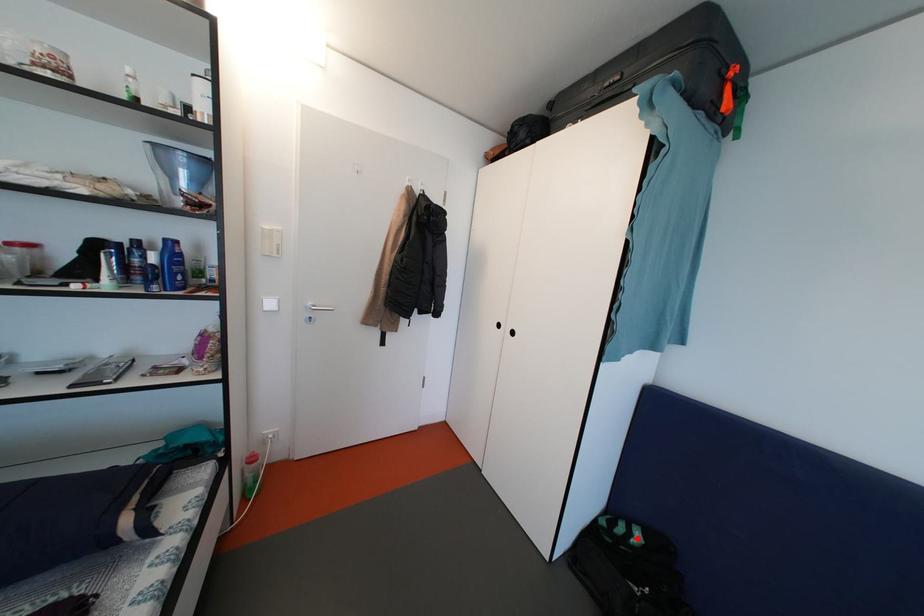
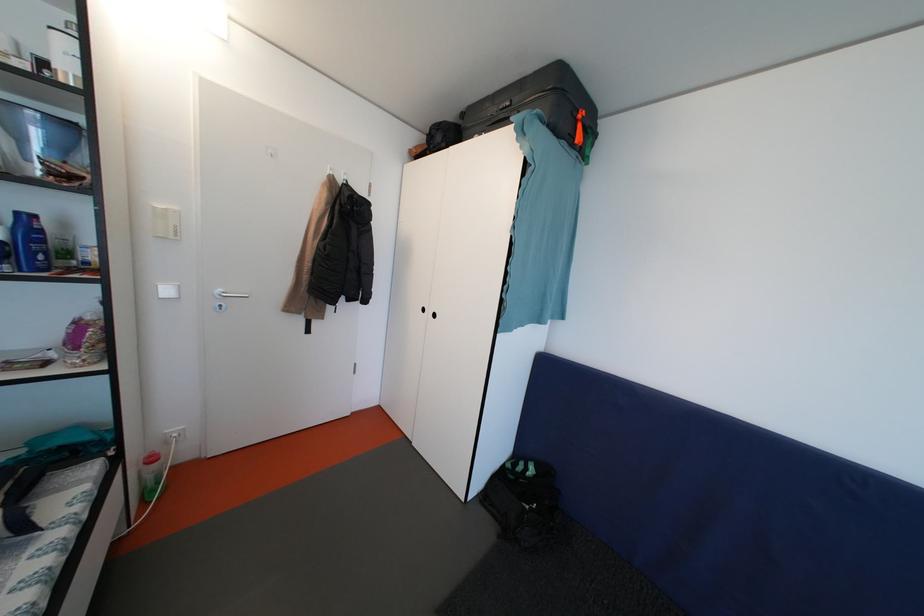
Question: I am providing you with two images of the same scene from different viewpoints. Given a red point in image1, look at the same physical point in image2. Is it:

Choices:
 (A) Closer to the viewpoint
 (B) Farther from the viewpoint

Answer: (A)